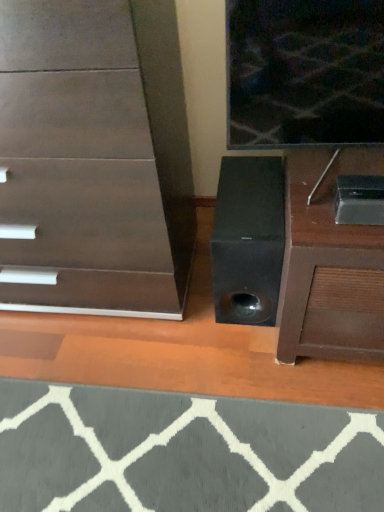
Image resolution: width=384 pixels, height=512 pixels. Identify the location of vacant space in front of dark wood chest of drawers at center. (233, 411).